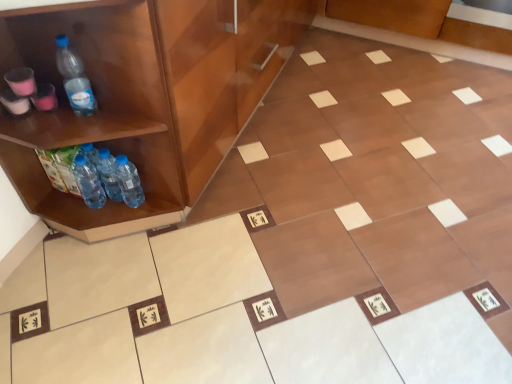
Question: In terms of width, does transparent plastic bottle at left, the 3th bottle positioned from the right, look wider or thinner when compared to blue plastic bottle at lower left, which is the 1th bottle in left-to-right order?

Choices:
 (A) thin
 (B) wide

Answer: (A)

Question: Is point (59, 39) positioned closer to the camera than point (78, 180)?

Choices:
 (A) closer
 (B) farther

Answer: (A)

Question: Estimate the real-world distances between objects in this image. Which object is farther from the translucent plastic bottles at left, acting as the third bottle starting from the left?

Choices:
 (A) brown glossy cabinet at left
 (B) translucent plastic bottles at lower left, placed as the fourth bottle when sorted from left to right
 (C) blue plastic bottle at lower left, which is the 1th bottle in left-to-right order
 (D) transparent plastic bottle at left, acting as the second bottle starting from the left

Answer: (A)

Question: Which of these objects is positioned closest to the blue plastic bottle at lower left, which is the 1th bottle in left-to-right order?

Choices:
 (A) transparent plastic bottle at left, acting as the second bottle starting from the left
 (B) translucent plastic bottles at left, acting as the third bottle starting from the left
 (C) brown glossy cabinet at left
 (D) translucent plastic bottles at lower left, the first bottle viewed from the right

Answer: (B)